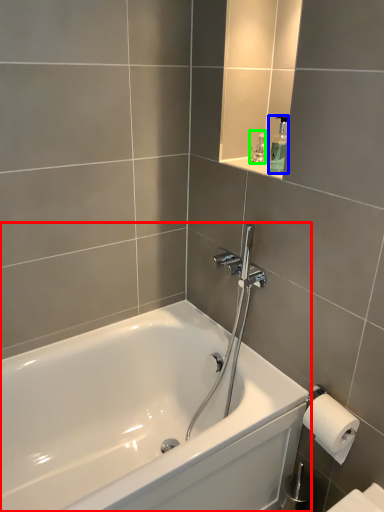
Question: Based on their relative distances, which object is nearer to bathtub (highlighted by a red box)? Choose from soap dispenser (highlighted by a blue box) and toiletry (highlighted by a green box).

Choices:
 (A) soap dispenser
 (B) toiletry

Answer: (A)